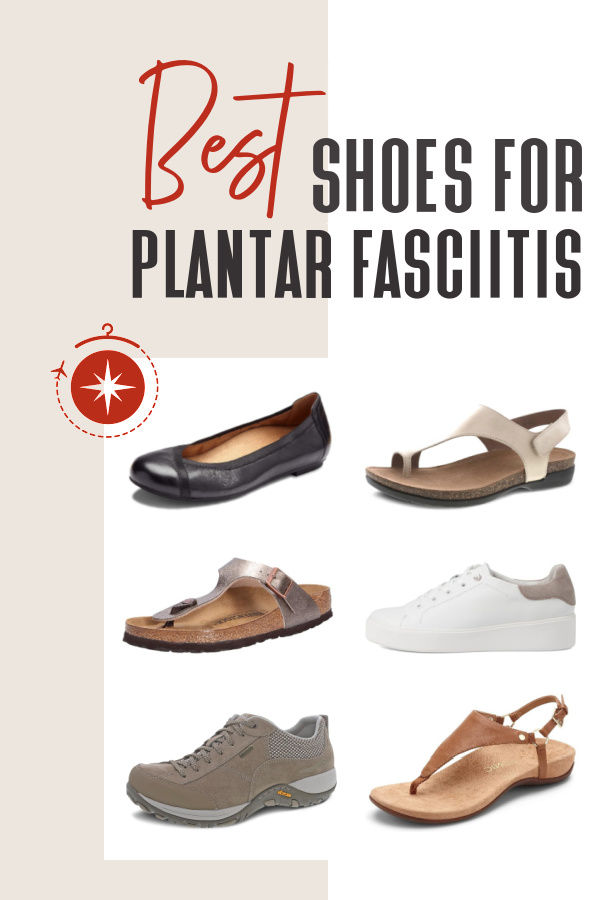
I want to click on back support, so click(x=558, y=706), click(x=318, y=729), click(x=316, y=409), click(x=558, y=424), click(x=554, y=576).